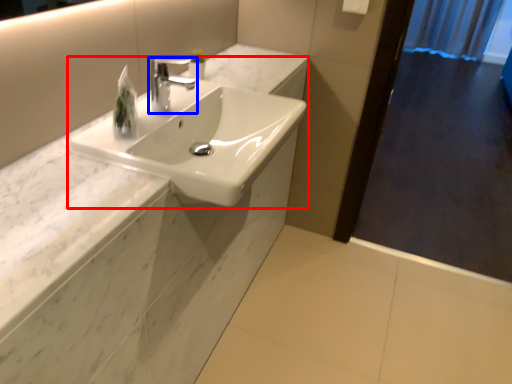
Question: Which object appears closest to the camera in this image, sink (highlighted by a red box) or tap (highlighted by a blue box)?

Choices:
 (A) sink
 (B) tap

Answer: (A)